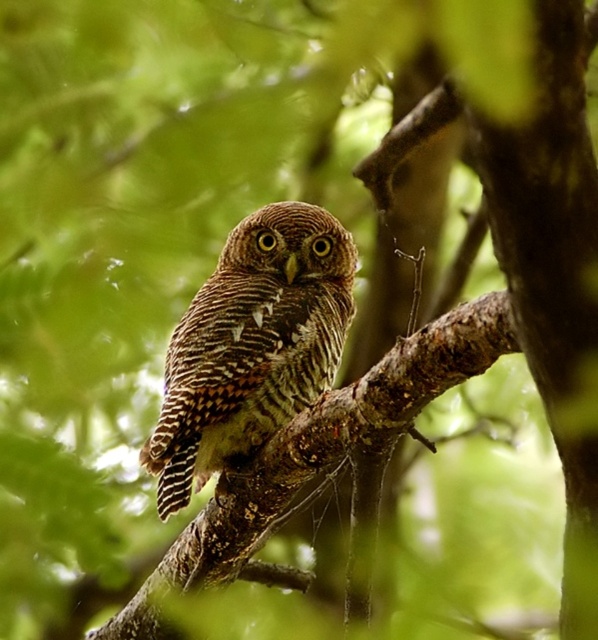
You are a birdwatcher trying to identify the owl in the forest. You notice both the brown speckled owl at center and the brown rough tree branch at center. Which object is taller?

The brown speckled owl at center is shorter than the brown rough tree branch at center, so the brown rough tree branch at center is taller.

Looking at this image, you are a photographer aiming to capture the brown speckled owl at center and the brown rough tree branch at center in a single frame. Based on their positions, which object should you adjust your camera focus to first if you want to ensure both are in focus?

The brown speckled owl at center is to the left of the brown rough tree branch at center. To ensure both are in focus, you should focus on the brown speckled owl at center first since it is closer to the camera, and then adjust the focus towards the brown rough tree branch at center which is further away.

You are an ornithologist observing the brown speckled owl at center and the brown rough tree branch at center in the forest. If you were to draw a straight line from the owl to the branch, would the branch appear in front of or behind the owl?

The brown rough tree branch at center is behind the brown speckled owl at center, so the branch would appear behind the owl if you draw a straight line from it.